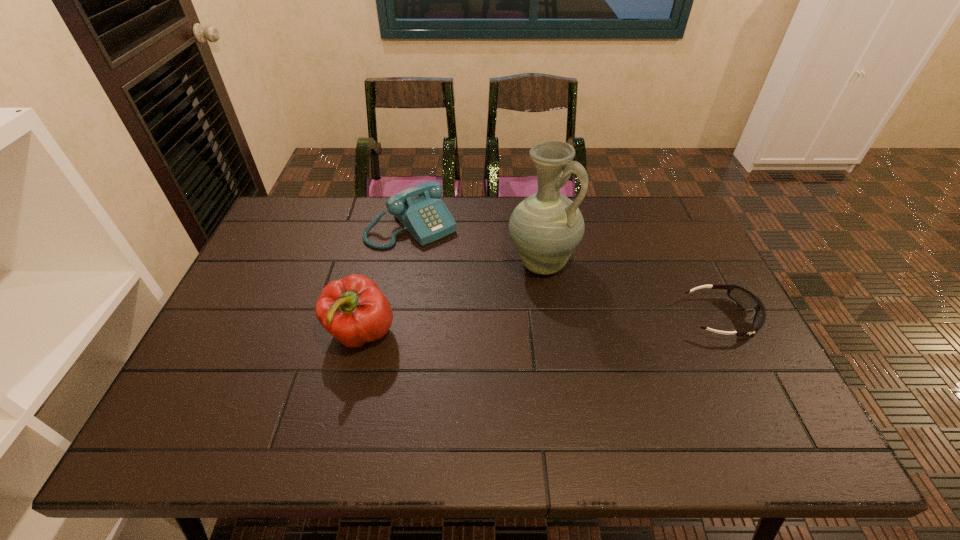
Locate which object ranks second in proximity to the rightmost object. Please provide its 2D coordinates. Your answer should be formatted as a tuple, i.e. [(x, y)], where the tuple contains the x and y coordinates of a point satisfying the conditions above.

[(419, 209)]

Image resolution: width=960 pixels, height=540 pixels. I want to click on object that is the second closest to the telephone, so [x=352, y=309].

I want to click on vacant area that satisfies the following two spatial constraints: 1. on the back side of the bell pepper; 2. on the front and sides of the rightmost object, so click(366, 318).

You are a GUI agent. You are given a task and a screenshot of the screen. Output one action in this format:
    pyautogui.click(x=<x>, y=<y>)
    Task: Click on the blank space that satisfies the following two spatial constraints: 1. on the back side of the bell pepper; 2. on the right side of the tallest object
    
    Given the screenshot: What is the action you would take?
    [378, 264]

This screenshot has height=540, width=960. Find the location of `vacant space that satisfies the following two spatial constraints: 1. on the back side of the goggles; 2. on the front and sides of the bell pepper`. vacant space that satisfies the following two spatial constraints: 1. on the back side of the goggles; 2. on the front and sides of the bell pepper is located at coordinates (366, 318).

Locate an element on the screen. The height and width of the screenshot is (540, 960). vacant space that satisfies the following two spatial constraints: 1. on the back side of the goggles; 2. on the front and sides of the bell pepper is located at coordinates (366, 318).